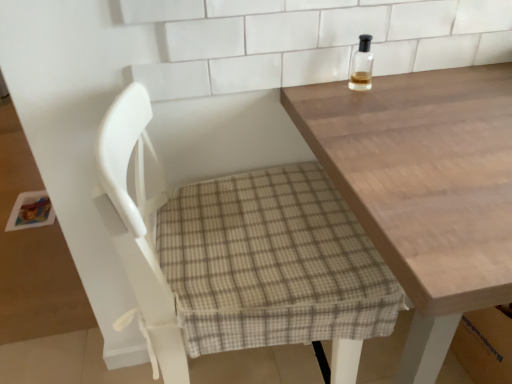
Find the location of `vacant area that lies to the right of clear glass bottle at upper right`. vacant area that lies to the right of clear glass bottle at upper right is located at coordinates (436, 91).